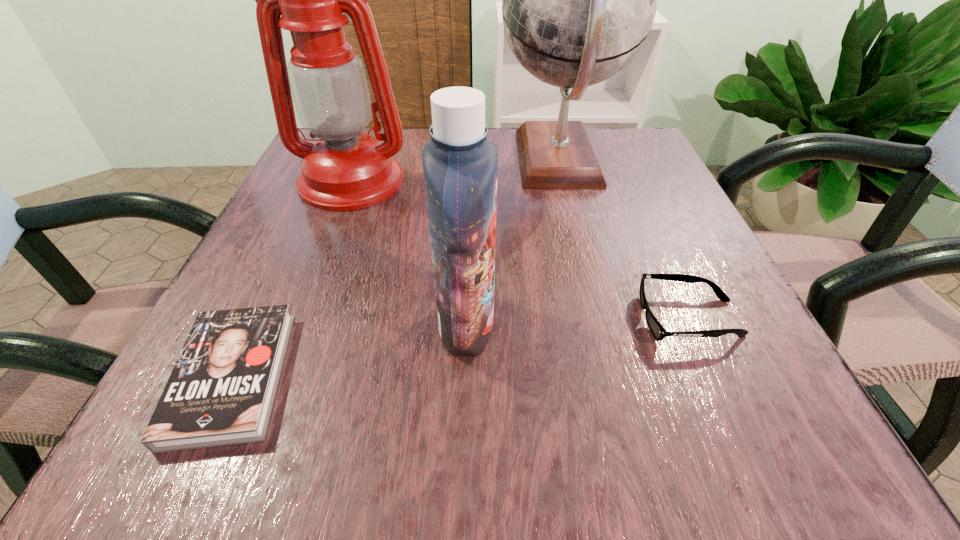
I want to click on vacant area located on the front label of the third object from right to left, so click(657, 323).

Where is `vacant position located on the front-facing side of the sunglasses`? The height and width of the screenshot is (540, 960). vacant position located on the front-facing side of the sunglasses is located at coordinates (590, 318).

At what (x,y) coordinates should I click in order to perform the action: click on free space located 0.290m on the front-facing side of the sunglasses. Please return your answer as a coordinate pair (x, y). Image resolution: width=960 pixels, height=540 pixels. Looking at the image, I should click on (437, 318).

Locate an element on the screen. vacant area situated on the front-facing side of the sunglasses is located at coordinates (478, 318).

Image resolution: width=960 pixels, height=540 pixels. I want to click on vacant region located on the right of the book, so click(x=335, y=376).

I want to click on globe that is at the far edge, so click(579, 0).

I want to click on oil lamp located at the far edge, so click(x=344, y=170).

Find the location of a particular element. object that is at the near edge is located at coordinates (221, 391).

This screenshot has height=540, width=960. What are the coordinates of `oil lamp located at the left edge` in the screenshot? It's located at (344, 170).

You are a GUI agent. You are given a task and a screenshot of the screen. Output one action in this format:
    pyautogui.click(x=<x>, y=<y>)
    Task: Click on the book that is at the left edge
    This screenshot has height=540, width=960.
    Given the screenshot: What is the action you would take?
    pyautogui.click(x=221, y=391)